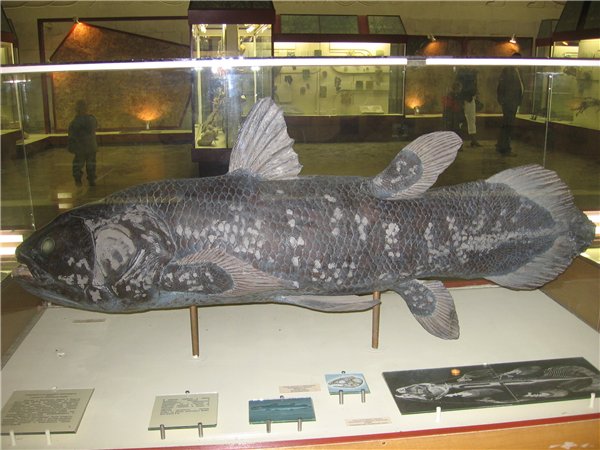
The image size is (600, 450). What are the coordinates of `floor` in the screenshot? It's located at (125, 171), (362, 160).